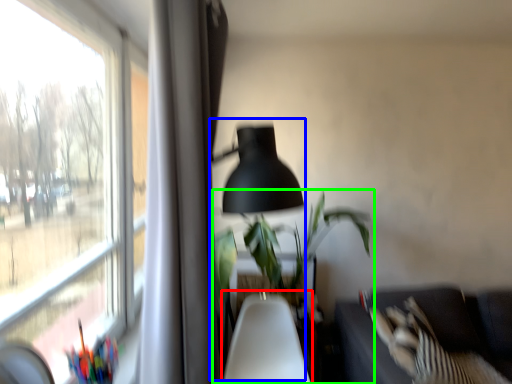
Question: Considering the real-world distances, which object is farthest from swivel chair (highlighted by a red box)? table lamp (highlighted by a blue box) or houseplant (highlighted by a green box)?

Choices:
 (A) table lamp
 (B) houseplant

Answer: (A)